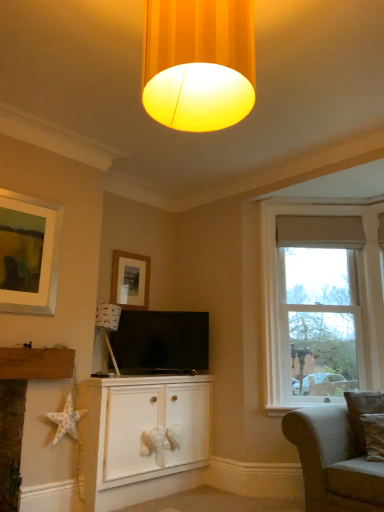
Question: Is white textured star at lower left thinner than clear glass window at right?

Choices:
 (A) no
 (B) yes

Answer: (B)

Question: Is white textured star at lower left closer to the viewer compared to clear glass window at right?

Choices:
 (A) yes
 (B) no

Answer: (A)

Question: Is white textured star at lower left further to camera compared to clear glass window at right?

Choices:
 (A) yes
 (B) no

Answer: (B)

Question: From the image's perspective, would you say white textured star at lower left is positioned over clear glass window at right?

Choices:
 (A) no
 (B) yes

Answer: (A)

Question: Are white textured star at lower left and clear glass window at right far apart?

Choices:
 (A) yes
 (B) no

Answer: (A)

Question: Would you say brown textured pillow at lower right is inside or outside white matte cabinet at center?

Choices:
 (A) inside
 (B) outside

Answer: (B)

Question: Is brown textured pillow at lower right taller or shorter than white matte cabinet at center?

Choices:
 (A) short
 (B) tall

Answer: (A)

Question: Considering the positions of brown textured pillow at lower right and white matte cabinet at center in the image, is brown textured pillow at lower right bigger or smaller than white matte cabinet at center?

Choices:
 (A) small
 (B) big

Answer: (A)

Question: Is brown textured pillow at lower right in front of or behind white matte cabinet at center in the image?

Choices:
 (A) behind
 (B) front

Answer: (B)

Question: From their relative heights in the image, would you say matte black tv at center is taller or shorter than matte yellow fabric lampshade at upper center?

Choices:
 (A) short
 (B) tall

Answer: (A)

Question: Is matte black tv at center in front of or behind matte yellow fabric lampshade at upper center in the image?

Choices:
 (A) behind
 (B) front

Answer: (A)

Question: From the image's perspective, relative to matte yellow fabric lampshade at upper center, is matte black tv at center above or below?

Choices:
 (A) below
 (B) above

Answer: (A)

Question: Is matte black tv at center situated inside matte yellow fabric lampshade at upper center or outside?

Choices:
 (A) inside
 (B) outside

Answer: (B)

Question: Considering the positions of white paper star at lower left and matte yellow fabric lampshade at upper center in the image, is white paper star at lower left taller or shorter than matte yellow fabric lampshade at upper center?

Choices:
 (A) tall
 (B) short

Answer: (B)

Question: Considering the relative positions of white paper star at lower left and matte yellow fabric lampshade at upper center in the image provided, is white paper star at lower left to the left or to the right of matte yellow fabric lampshade at upper center?

Choices:
 (A) left
 (B) right

Answer: (A)